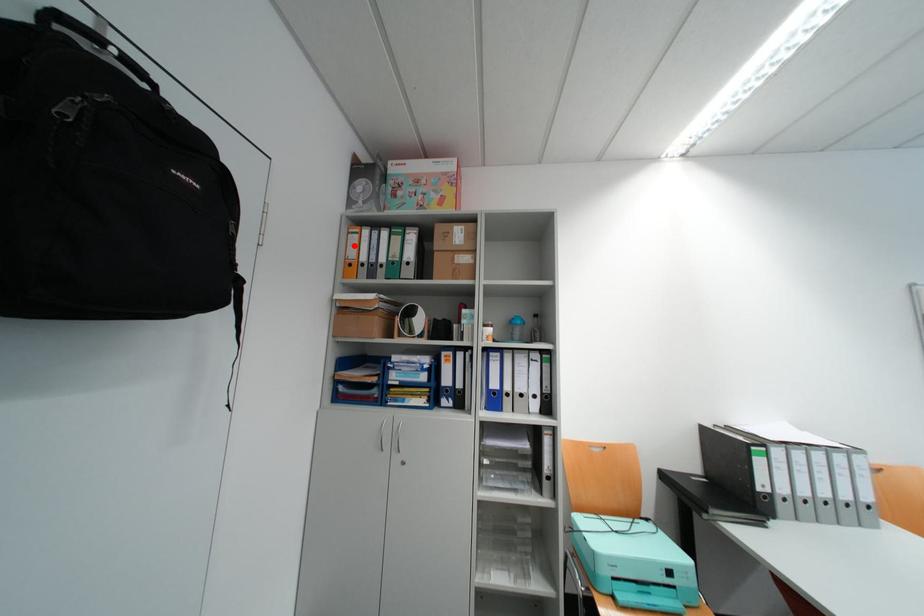
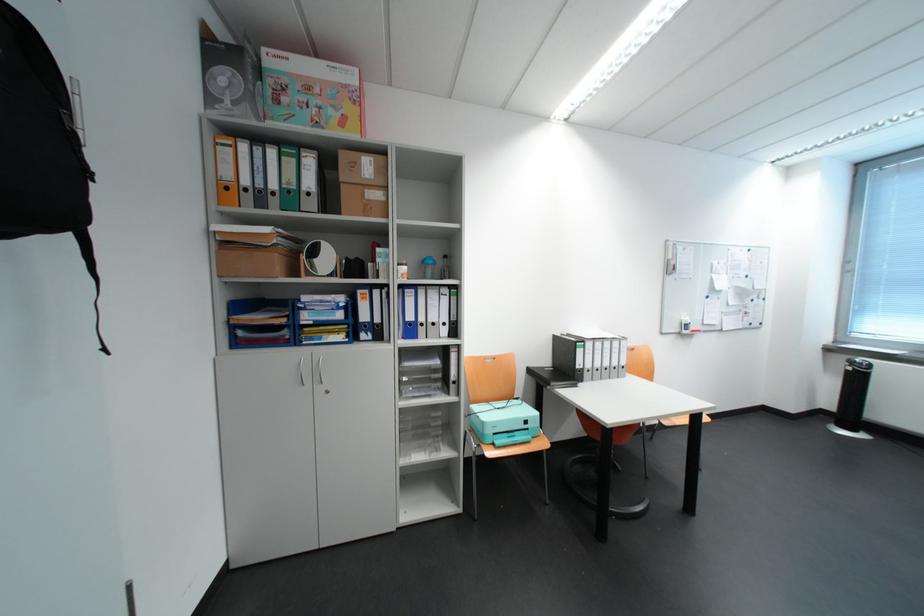
Locate, in the second image, the point that corresponds to the highlighted location in the first image.

(221, 160)